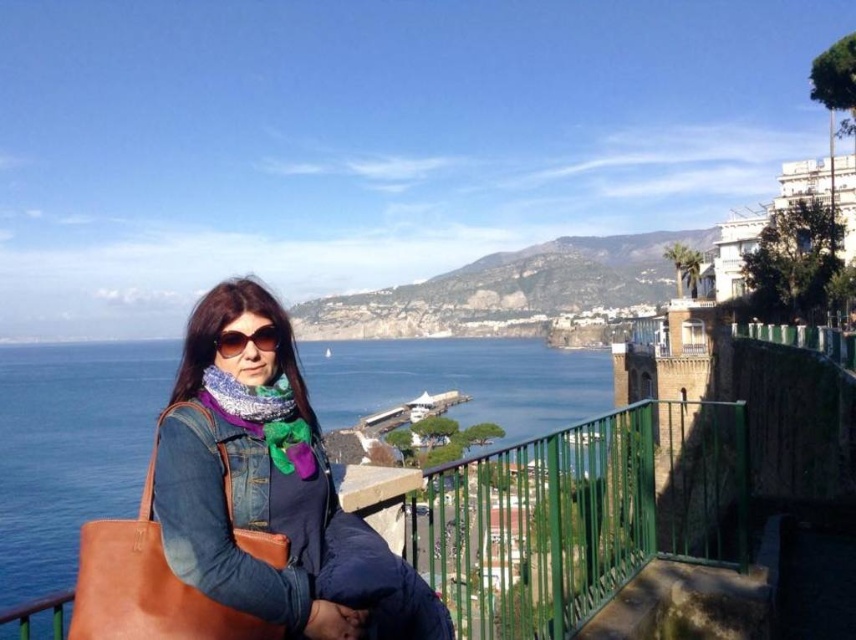
Question: Which object is closer to the camera taking this photo?

Choices:
 (A) leather bag at left
 (B) blue water at center
 (C) knitted multicolor scarf at center
 (D) denim jacket at center

Answer: (B)

Question: Considering the real-world distances, which object is closest to the sunglasses at center?

Choices:
 (A) leather bag at left
 (B) blue water at center
 (C) knitted multicolor scarf at center

Answer: (C)

Question: Does blue water at center have a smaller size compared to knitted multicolor scarf at center?

Choices:
 (A) no
 (B) yes

Answer: (A)

Question: Which of the following is the farthest from the observer?

Choices:
 (A) click(242, 388)
 (B) click(205, 604)
 (C) click(244, 337)
 (D) click(584, 390)

Answer: (D)

Question: Is blue water at center closer to camera compared to sunglasses at center?

Choices:
 (A) yes
 (B) no

Answer: (A)

Question: Does blue water at center lie in front of leather bag at left?

Choices:
 (A) yes
 (B) no

Answer: (A)